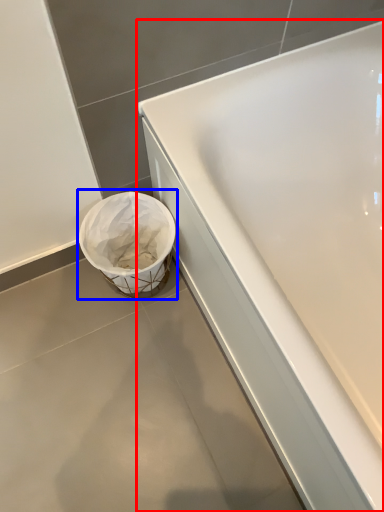
Question: Which object is closer to the camera taking this photo, bathtub (highlighted by a red box) or waste container (highlighted by a blue box)?

Choices:
 (A) bathtub
 (B) waste container

Answer: (A)